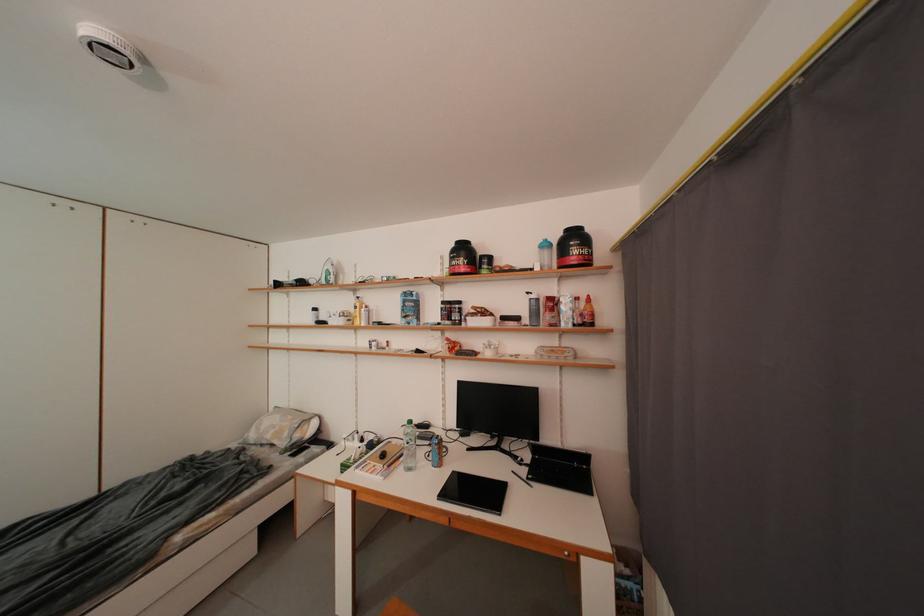
The height and width of the screenshot is (616, 924). In order to click on white steam iron in this screenshot , I will do [x=108, y=47].